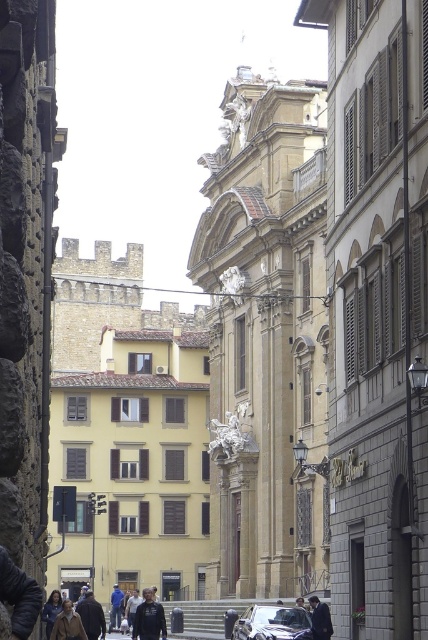
Can you confirm if dark gray suit at center is positioned above dark blue jeans at lower left?

Correct, dark gray suit at center is located above dark blue jeans at lower left.

Between point (320, 616) and point (118, 605), which one is positioned in front?

Point (320, 616) is more forward.

Image resolution: width=428 pixels, height=640 pixels. In order to click on dark gray suit at center in this screenshot , I will do point(320,618).

Who is lower down, dark brown leather jacket at lower left or brown leather jacket at lower left?

Positioned lower is dark brown leather jacket at lower left.

Between dark brown leather jacket at lower left and brown leather jacket at lower left, which one is positioned higher?

brown leather jacket at lower left is above.

Who is more distant from viewer, (98, 632) or (77, 612)?

The point (98, 632) is behind.

Image resolution: width=428 pixels, height=640 pixels. Identify the location of dark brown leather jacket at lower left. (92, 616).

Is point (71, 612) more distant than point (318, 612)?

No, it is in front of (318, 612).

Does brown leather jacket at lower left have a greater width compared to dark gray suit at center?

Correct, the width of brown leather jacket at lower left exceeds that of dark gray suit at center.

Does point (56, 627) lie behind point (315, 637)?

No, it is not.

The width and height of the screenshot is (428, 640). What are the coordinates of `brown leather jacket at lower left` in the screenshot? It's located at (68, 624).